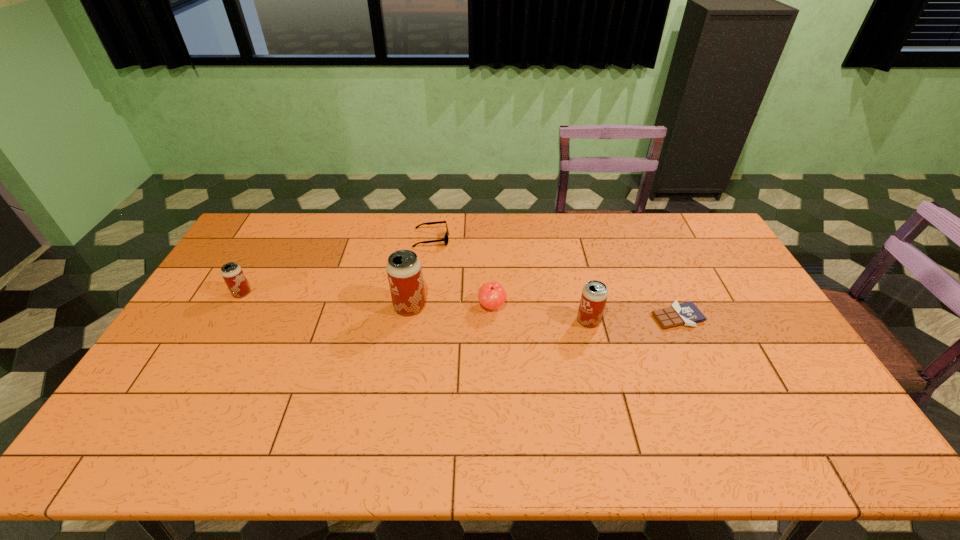
Find the location of a particular element. This screenshot has height=540, width=960. apple is located at coordinates (491, 295).

Find the location of a particular element. the fourth object from left to right is located at coordinates (491, 295).

Find the location of a particular element. Image resolution: width=960 pixels, height=540 pixels. vacant space positioned 0.170m on the back of the fourth shortest object is located at coordinates (264, 254).

Identify the location of vacant space situated 0.300m on the left of the tallest object. (297, 307).

This screenshot has width=960, height=540. What are the coordinates of `free point located on the front of the second tallest object` in the screenshot? It's located at (597, 354).

The image size is (960, 540). What are the coordinates of `free space located on the front-facing side of the sunglasses` in the screenshot? It's located at (495, 239).

Find the location of a particular element. vacant position located 0.150m on the back of the rightmost object is located at coordinates (657, 272).

Where is `vacant space located on the right of the third object from right to left`? This screenshot has height=540, width=960. vacant space located on the right of the third object from right to left is located at coordinates (618, 306).

At what (x,y) coordinates should I click in order to perform the action: click on object at the far edge. Please return your answer as a coordinate pair (x, y). The width and height of the screenshot is (960, 540). Looking at the image, I should click on (445, 239).

Find the location of `object positioned at the left edge`. object positioned at the left edge is located at coordinates pyautogui.click(x=232, y=273).